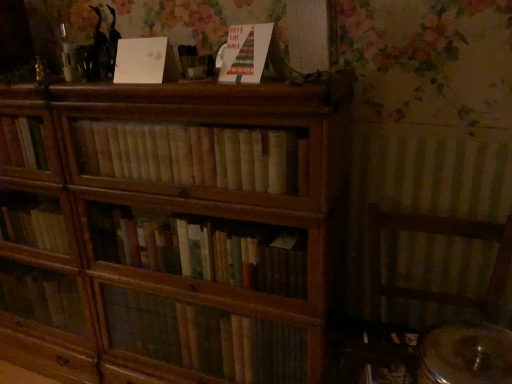
Question: Is white matte paper at upper center, the 2th paperback book when ordered from right to left, inside or outside of light brown wooden books at center?

Choices:
 (A) inside
 (B) outside

Answer: (B)

Question: Is white matte paper at upper center, the 2th paperback book when ordered from right to left, bigger or smaller than light brown wooden books at center?

Choices:
 (A) big
 (B) small

Answer: (B)

Question: Estimate the real-world distances between objects in this image. Which object is closer to the white matte paper at upper center, the 2th paperback book when ordered from right to left?

Choices:
 (A) light brown wooden books at center
 (B) matte paper card at upper center, the first paperback book from the right

Answer: (B)

Question: Which is farther from the white matte paper at upper center, the first paperback book when ordered from left to right?

Choices:
 (A) light brown wooden books at center
 (B) matte paper card at upper center, the first paperback book from the right

Answer: (A)